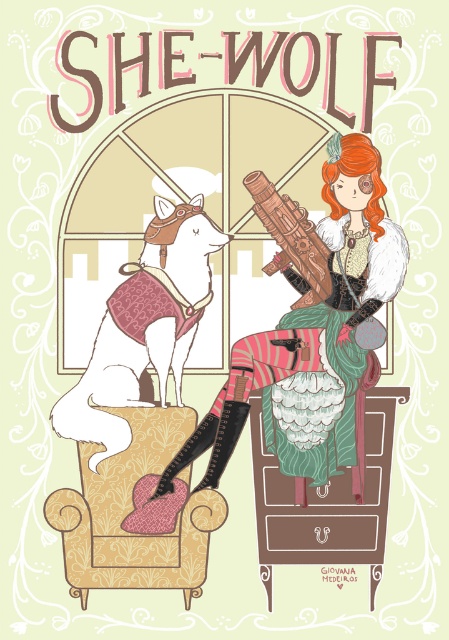
Question: Can you confirm if patterned fabric armchair at center is bigger than green fabric armchair at center?

Choices:
 (A) no
 (B) yes

Answer: (B)

Question: Can you confirm if green fabric armchair at center is positioned below wooden carved gun at center?

Choices:
 (A) yes
 (B) no

Answer: (A)

Question: Which of these objects is positioned farthest from the green fabric armchair at center?

Choices:
 (A) patterned fabric armchair at center
 (B) velvet-patterned armchair at left

Answer: (B)

Question: Which of the following is the farthest from the observer?

Choices:
 (A) (180, 310)
 (B) (333, 276)
 (C) (92, 563)
 (D) (280, 477)

Answer: (A)

Question: Which point is closer to the camera?

Choices:
 (A) green fabric armchair at center
 (B) velvet-patterned armchair at left
 (C) wooden carved gun at center
 (D) patterned fabric armchair at center

Answer: (C)

Question: Considering the relative positions of matte brown gun at center and velvet-patterned armchair at left in the image provided, where is matte brown gun at center located with respect to velvet-patterned armchair at left?

Choices:
 (A) left
 (B) right

Answer: (B)